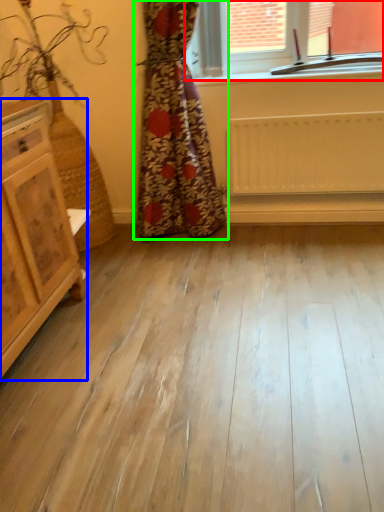
Question: Based on their relative distances, which object is farther from window (highlighted by a red box)? Choose from chest of drawers (highlighted by a blue box) and curtain (highlighted by a green box).

Choices:
 (A) chest of drawers
 (B) curtain

Answer: (A)